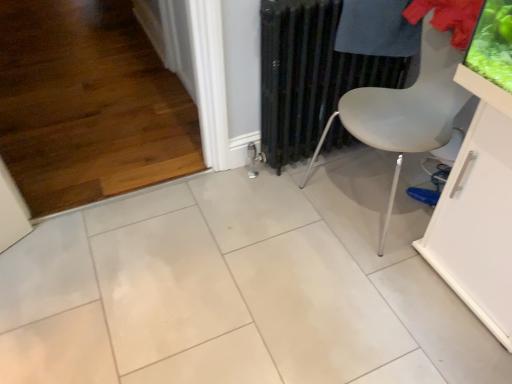
Where is `free space in front of black metal radiator at center`? The width and height of the screenshot is (512, 384). free space in front of black metal radiator at center is located at coordinates (312, 221).